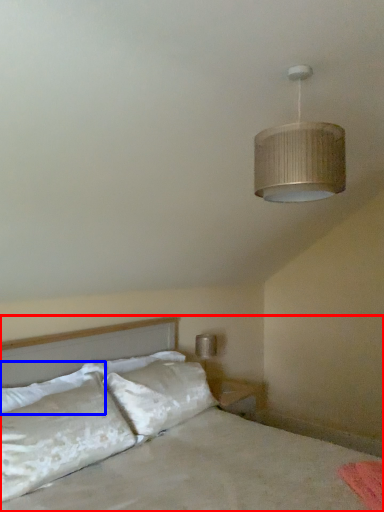
Question: Among these objects, which one is farthest to the camera, bed (highlighted by a red box) or pillow (highlighted by a blue box)?

Choices:
 (A) bed
 (B) pillow

Answer: (B)